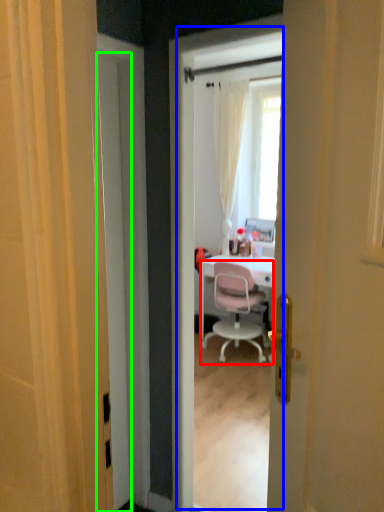
Question: Which object is positioned closest to chair (highlighted by a red box)? Select from screen door (highlighted by a blue box) and door (highlighted by a green box).

Choices:
 (A) screen door
 (B) door

Answer: (A)